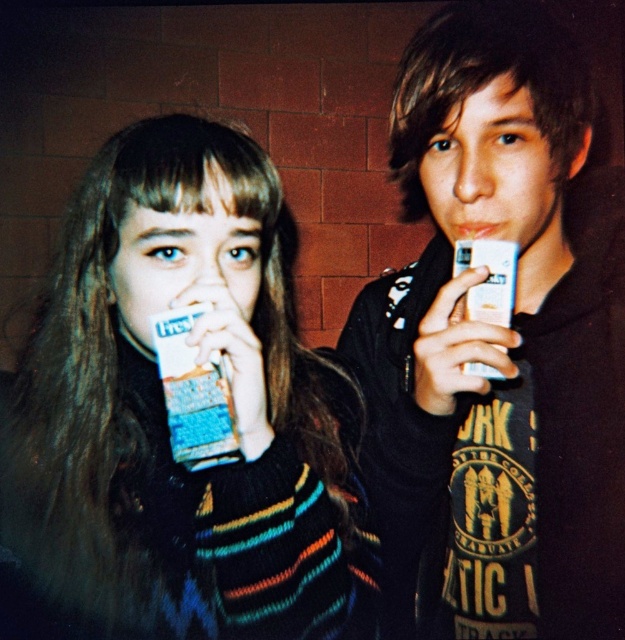
Question: Is knitted sweater at left thinner than matte white teeth at upper center?

Choices:
 (A) yes
 (B) no

Answer: (B)

Question: Can you confirm if knitted sweater at left is bigger than matte black phone at right?

Choices:
 (A) no
 (B) yes

Answer: (B)

Question: Which point is closer to the camera taking this photo?

Choices:
 (A) (x=146, y=196)
 (B) (x=446, y=54)
 (C) (x=471, y=234)

Answer: (A)

Question: Which point is closer to the camera?

Choices:
 (A) (402, 186)
 (B) (256, 552)
 (C) (485, 236)

Answer: (B)

Question: Can you confirm if matte black phone at right is smaller than matte white teeth at upper center?

Choices:
 (A) no
 (B) yes

Answer: (A)

Question: Which object is farther from the camera taking this photo?

Choices:
 (A) matte black phone at right
 (B) knitted sweater at left
 (C) matte white teeth at upper center

Answer: (C)